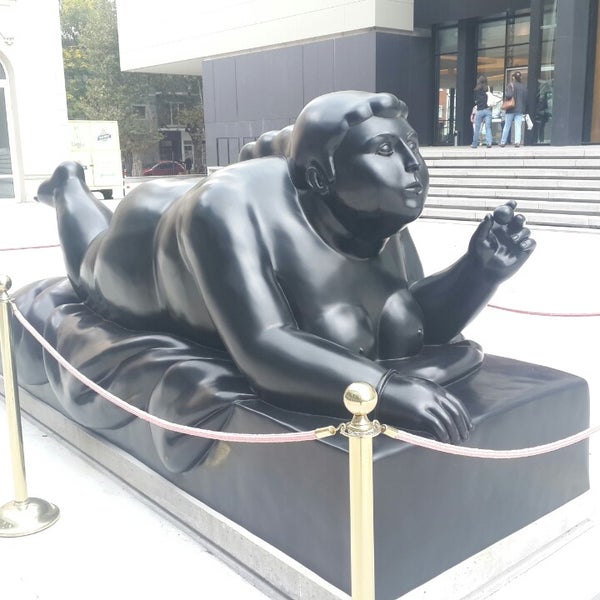
Find the location of a particular element. stand is located at coordinates (356, 430).